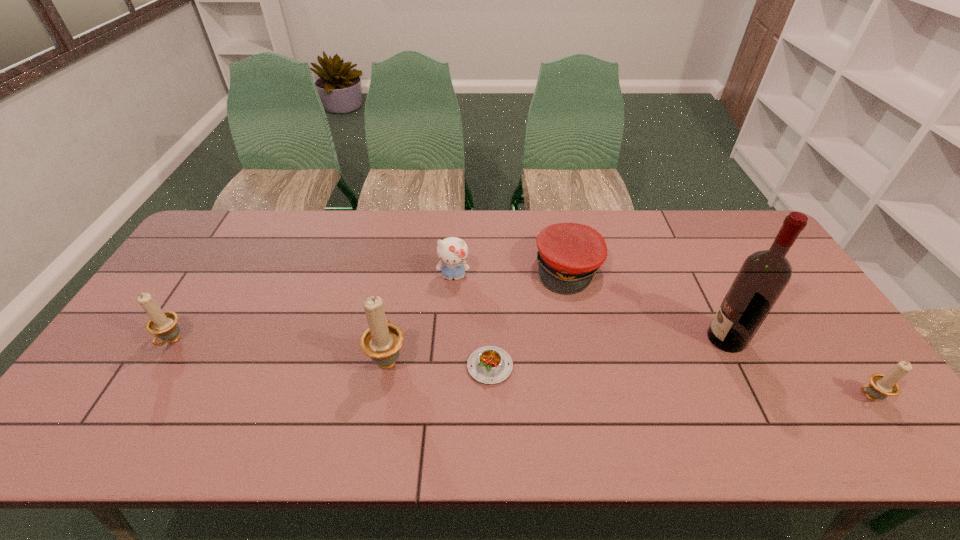
You are a GUI agent. You are given a task and a screenshot of the screen. Output one action in this format:
    pyautogui.click(x=<x>, y=<y>)
    Task: Click on the vacant space located 0.250m on the front of the cap with an emblem
    The height and width of the screenshot is (540, 960).
    Given the screenshot: What is the action you would take?
    pyautogui.click(x=588, y=366)

Where is `vacant space located 0.160m on the front and back of the tallest object`? vacant space located 0.160m on the front and back of the tallest object is located at coordinates (648, 339).

Image resolution: width=960 pixels, height=540 pixels. In order to click on free space located on the front and back of the tallest object in this screenshot , I will do `click(570, 339)`.

This screenshot has width=960, height=540. I want to click on free region located 0.380m on the front and back of the tallest object, so click(566, 339).

Locate an element on the screen. vacant point located on the left of the pudding is located at coordinates (326, 366).

Where is `object at the far edge`? object at the far edge is located at coordinates (569, 255).

Locate an element on the screen. This screenshot has height=540, width=960. pudding situated at the near edge is located at coordinates (490, 365).

Where is `object that is positioned at the left edge`? object that is positioned at the left edge is located at coordinates (162, 324).

The height and width of the screenshot is (540, 960). Identify the location of object that is positioned at the right edge. (881, 386).

I want to click on object located at the near right corner, so click(881, 386).